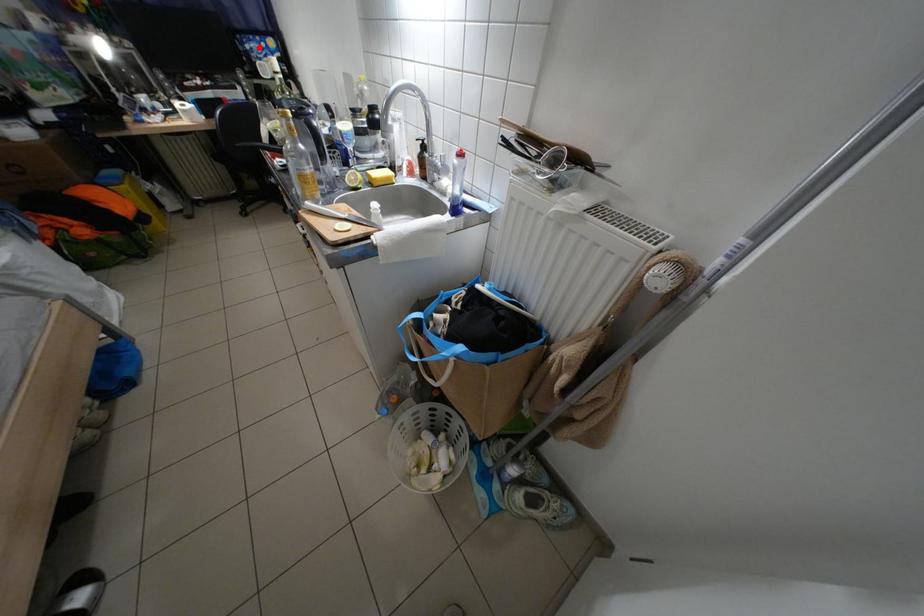
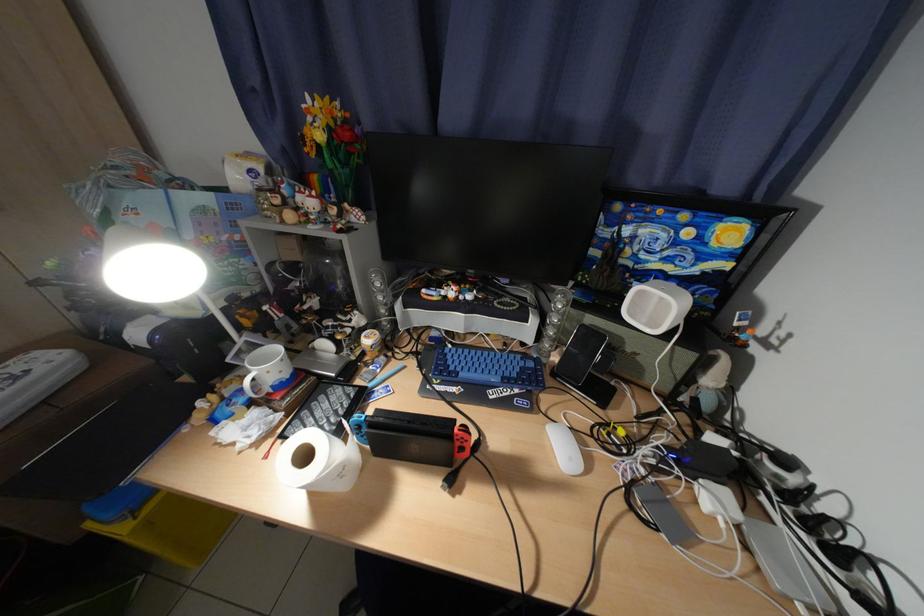
Where in the second image is the point corresponding to the highlighted location from the first image?

(638, 233)